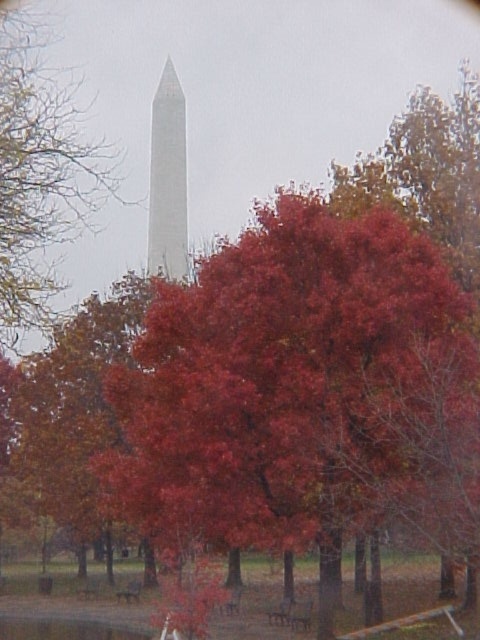
Question: Among these points, which one is farthest from the camera?

Choices:
 (A) (467, 397)
 (B) (17, 124)

Answer: (B)

Question: Which object appears farthest from the camera in this image?

Choices:
 (A) shiny red leaves at center
 (B) white marble tower at center

Answer: (B)

Question: Among these objects, which one is nearest to the camera?

Choices:
 (A) shiny red leaves at center
 (B) smooth red tree at upper center
 (C) white marble tower at center

Answer: (B)

Question: Where is smooth red tree at upper center located in relation to white marble tower at center in the image?

Choices:
 (A) left
 (B) right

Answer: (A)

Question: Does shiny red leaves at center appear on the right side of smooth red tree at upper center?

Choices:
 (A) yes
 (B) no

Answer: (A)

Question: Does shiny red leaves at center come in front of white marble tower at center?

Choices:
 (A) no
 (B) yes

Answer: (B)